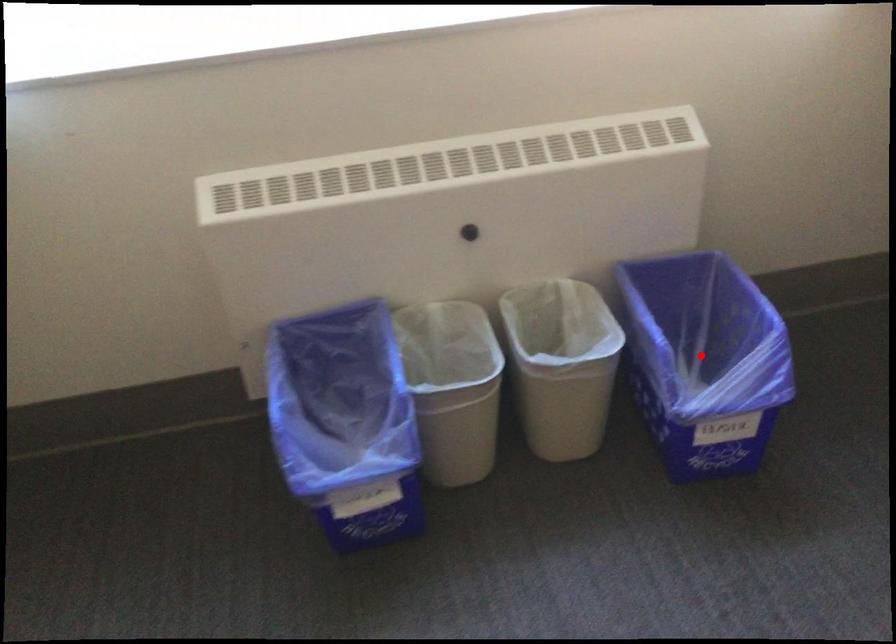
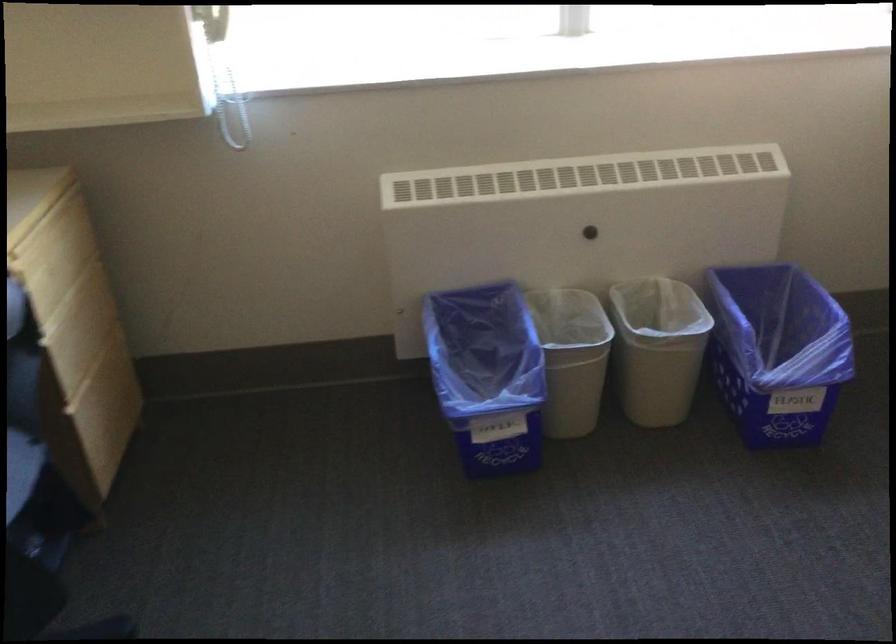
The point at the highlighted location is marked in the first image. Where is the corresponding point in the second image?

(777, 352)